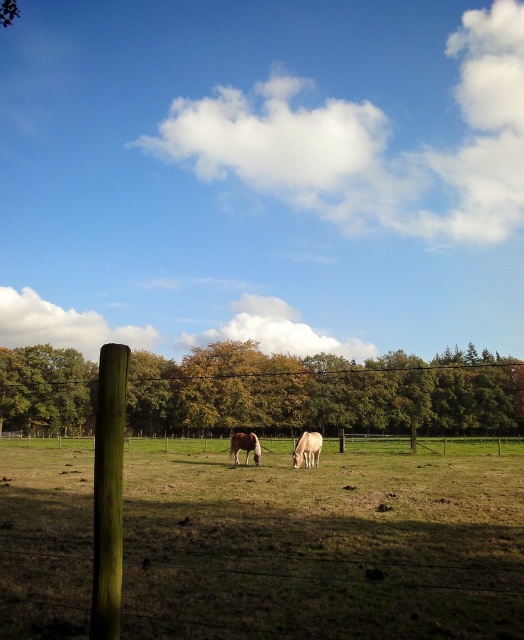
Which of these two, green wood post at left or green leafy tree at left, stands taller?

green wood post at left

Is green wood post at left behind green leafy tree at left?

That is False.

Describe the element at coordinates (108, 492) in the screenshot. I see `green wood post at left` at that location.

Where is `green wood post at left`? green wood post at left is located at coordinates (108, 492).

Consider the image. Can you confirm if green leafy tree at left is positioned below brown glossy horse at center?

Yes, green leafy tree at left is below brown glossy horse at center.

Is green leafy tree at left to the right of brown glossy horse at center from the viewer's perspective?

No, green leafy tree at left is not to the right of brown glossy horse at center.

Who is more distant from viewer, (24, 428) or (235, 456)?

Point (24, 428)

This screenshot has width=524, height=640. In order to click on green leafy tree at left in this screenshot , I will do (46, 388).

Does green leafy trees at center have a greater width compared to green leafy tree at left?

Yes.

Between point (183, 380) and point (63, 385), which one is positioned in front?

Point (63, 385) is more forward.

This screenshot has width=524, height=640. Identify the location of green leafy trees at center. (323, 392).